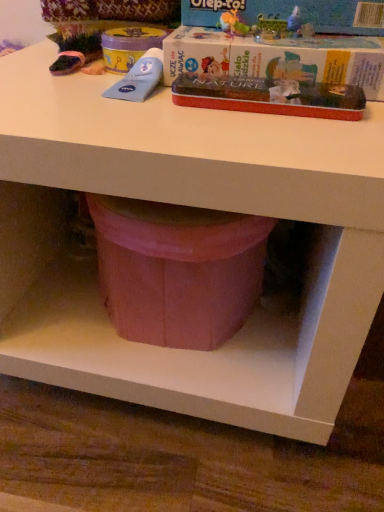
Question: From the image's perspective, is red cardboard box at upper center, which is the 2th paperback book from top to bottom, beneath matte cardboard box at upper center, which appears as the first paperback book when viewed from the top?

Choices:
 (A) no
 (B) yes

Answer: (B)

Question: Would you say red cardboard box at upper center, which is the 2th paperback book from top to bottom, is outside matte cardboard box at upper center, the third paperback book from the bottom?

Choices:
 (A) no
 (B) yes

Answer: (B)

Question: Is red cardboard box at upper center, which is the 2th paperback book from top to bottom, positioned with its back to matte cardboard box at upper center, which appears as the first paperback book when viewed from the top?

Choices:
 (A) no
 (B) yes

Answer: (A)

Question: Can you confirm if red cardboard box at upper center, which is the 2th paperback book from top to bottom, is wider than matte cardboard box at upper center, which appears as the first paperback book when viewed from the top?

Choices:
 (A) yes
 (B) no

Answer: (A)

Question: Does red cardboard box at upper center, which is the 2th paperback book from top to bottom, appear on the right side of matte cardboard box at upper center, the third paperback book from the bottom?

Choices:
 (A) no
 (B) yes

Answer: (A)

Question: Is red cardboard box at upper center, which is the 2th paperback book from top to bottom, to the left or to the right of metallic red tin at upper center, the third paperback book positioned from the top, in the image?

Choices:
 (A) left
 (B) right

Answer: (B)

Question: Relative to metallic red tin at upper center, the third paperback book positioned from the top, is red cardboard box at upper center, which is the 2th paperback book from top to bottom, in front or behind?

Choices:
 (A) behind
 (B) front

Answer: (A)

Question: In terms of height, does red cardboard box at upper center, which ranks as the second paperback book in bottom-to-top order, look taller or shorter compared to metallic red tin at upper center, the third paperback book positioned from the top?

Choices:
 (A) short
 (B) tall

Answer: (B)

Question: Considering the positions of point (211, 60) and point (339, 117), is point (211, 60) closer or farther from the camera than point (339, 117)?

Choices:
 (A) farther
 (B) closer

Answer: (A)

Question: Looking at their shapes, would you say metallic red tin at upper center, the third paperback book positioned from the top, is wider or thinner than matte cardboard box at upper center, the third paperback book from the bottom?

Choices:
 (A) wide
 (B) thin

Answer: (B)

Question: From the image's perspective, is metallic red tin at upper center, the third paperback book positioned from the top, above or below matte cardboard box at upper center, which appears as the first paperback book when viewed from the top?

Choices:
 (A) below
 (B) above

Answer: (A)

Question: In the image, is metallic red tin at upper center, the 1th paperback book positioned from the bottom, on the left side or the right side of matte cardboard box at upper center, which appears as the first paperback book when viewed from the top?

Choices:
 (A) left
 (B) right

Answer: (A)

Question: From a real-world perspective, relative to matte cardboard box at upper center, which appears as the first paperback book when viewed from the top, is metallic red tin at upper center, the 1th paperback book positioned from the bottom, vertically above or below?

Choices:
 (A) below
 (B) above

Answer: (A)

Question: Is metallic red tin at upper center, the third paperback book positioned from the top, bigger or smaller than red cardboard box at upper center, which is the 2th paperback book from top to bottom?

Choices:
 (A) big
 (B) small

Answer: (B)

Question: From a real-world perspective, is metallic red tin at upper center, the third paperback book positioned from the top, above or below red cardboard box at upper center, which ranks as the second paperback book in bottom-to-top order?

Choices:
 (A) above
 (B) below

Answer: (B)